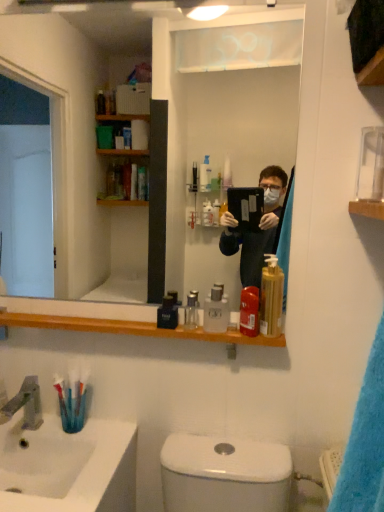
Question: From a real-world perspective, is translucent plastic toothbrush at lower left on white glossy sink at lower left?

Choices:
 (A) no
 (B) yes

Answer: (B)

Question: Is translucent plastic toothbrush at lower left outside white glossy sink at lower left?

Choices:
 (A) yes
 (B) no

Answer: (A)

Question: Would you consider translucent plastic toothbrush at lower left to be distant from white glossy sink at lower left?

Choices:
 (A) no
 (B) yes

Answer: (A)

Question: Can you confirm if translucent plastic toothbrush at lower left is wider than white glossy sink at lower left?

Choices:
 (A) no
 (B) yes

Answer: (A)

Question: Could you tell me if translucent plastic toothbrush at lower left is facing white glossy sink at lower left?

Choices:
 (A) no
 (B) yes

Answer: (A)

Question: From the image's perspective, is clear glass mirror at upper center positioned above or below satin nickel faucet at sink left?

Choices:
 (A) below
 (B) above

Answer: (B)

Question: Considering the positions of clear glass mirror at upper center and satin nickel faucet at sink left in the image, is clear glass mirror at upper center wider or thinner than satin nickel faucet at sink left?

Choices:
 (A) wide
 (B) thin

Answer: (B)

Question: Based on their positions, is clear glass mirror at upper center located to the left or right of satin nickel faucet at sink left?

Choices:
 (A) left
 (B) right

Answer: (B)

Question: From a real-world perspective, is clear glass mirror at upper center above or below satin nickel faucet at sink left?

Choices:
 (A) below
 (B) above

Answer: (B)

Question: Is black glossy bottle at center, which is the 1th mouthwash in left-to-right order, taller or shorter than clear glass mirror at upper center?

Choices:
 (A) tall
 (B) short

Answer: (B)

Question: Is black glossy bottle at center, which is the 1th mouthwash in left-to-right order, in front of or behind clear glass mirror at upper center in the image?

Choices:
 (A) behind
 (B) front

Answer: (A)

Question: From the image's perspective, is black glossy bottle at center, which is the 1th mouthwash in left-to-right order, positioned above or below clear glass mirror at upper center?

Choices:
 (A) below
 (B) above

Answer: (A)

Question: Based on their positions, is black glossy bottle at center, which is the 1th mouthwash in left-to-right order, located to the left or right of clear glass mirror at upper center?

Choices:
 (A) left
 (B) right

Answer: (B)

Question: From a real-world perspective, is translucent plastic toothbrush at lower left above or below satin nickel faucet at sink left?

Choices:
 (A) above
 (B) below

Answer: (A)

Question: Based on their positions, is translucent plastic toothbrush at lower left located to the left or right of satin nickel faucet at sink left?

Choices:
 (A) left
 (B) right

Answer: (B)